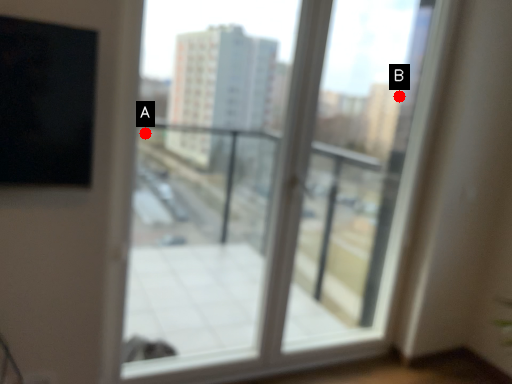
Question: Two points are circled on the image, labeled by A and B beside each circle. Which point is farther from the camera taking this photo?

Choices:
 (A) A is further
 (B) B is further

Answer: (A)